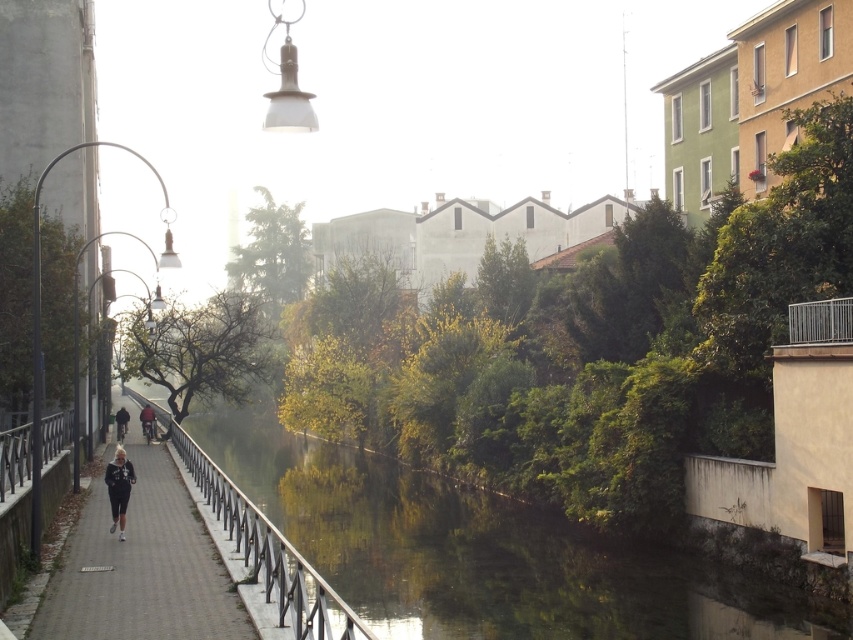
You are standing on the pathway next to the canal and want to take a photo of the green leafy river at center and the metallic gray railing at center. Which object should you aim your camera towards first if you want to capture both in a single shot without moving the camera?

You should aim your camera towards the metallic gray railing at center first because the green leafy river at center is positioned on the right side of it, so capturing the railing first will allow the river to be included in the frame on its right side without needing to adjust the camera position.

You are standing on the gray concrete pavement at center and want to reach the dark red fabric jacket at center. Which direction should you move to get closer to the jacket?

The gray concrete pavement at center is positioned over dark red fabric jacket at center, so you should move downward to get closer to the jacket.

You are standing at the edge of the canal and want to locate two specific points marked in the image. The first point is at coordinates point (173,621) and the second is at point (149,436). Which of these two points is closer to you?

Point (173,621) is closer to the viewer than point (149,436).